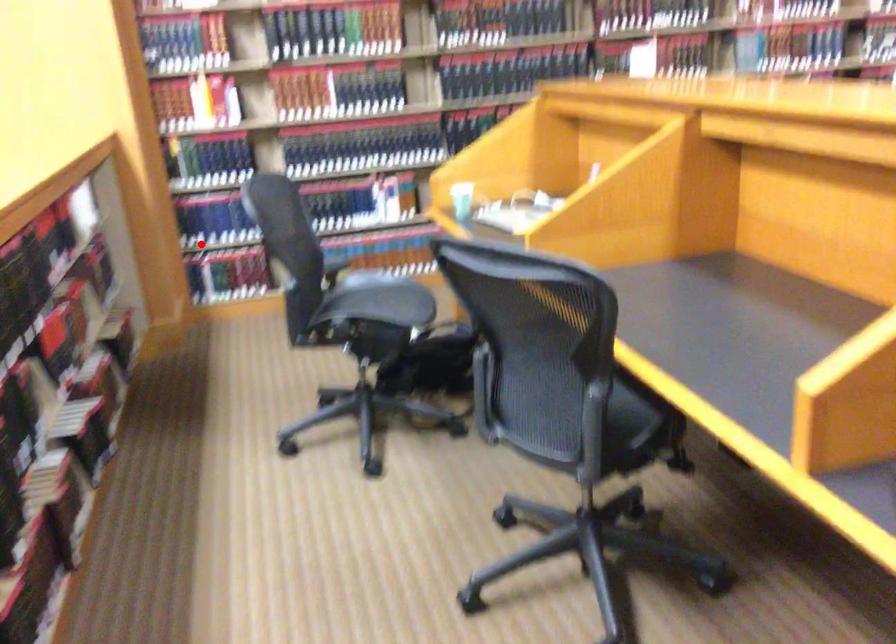
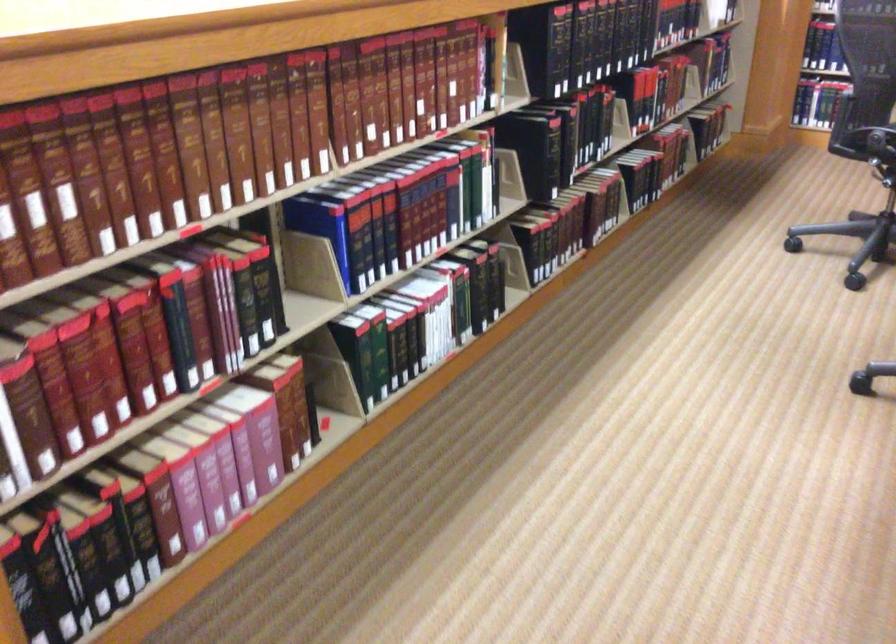
In the second image, find the point that corresponds to the highlighted location in the first image.

(833, 51)